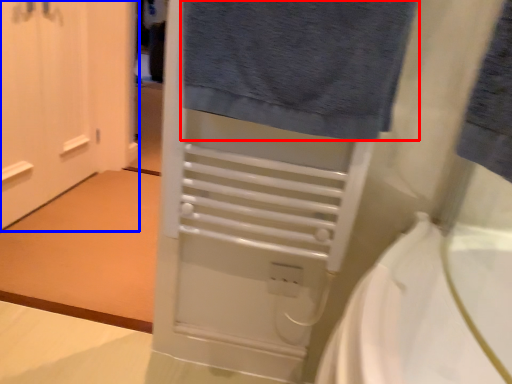
Question: Among these objects, which one is farthest to the camera, towel (highlighted by a red box) or door (highlighted by a blue box)?

Choices:
 (A) towel
 (B) door

Answer: (B)